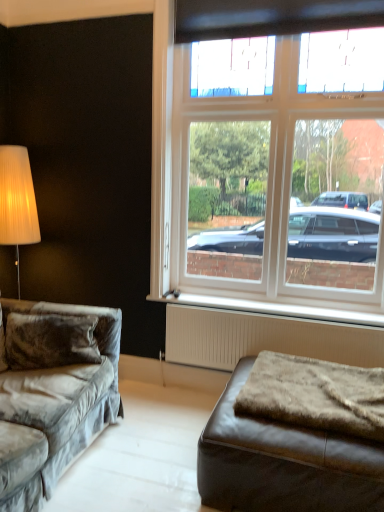
Where is `empty space that is ontop of white plastic radiator at lower center (from a real-world perspective)`? empty space that is ontop of white plastic radiator at lower center (from a real-world perspective) is located at coordinates (261, 301).